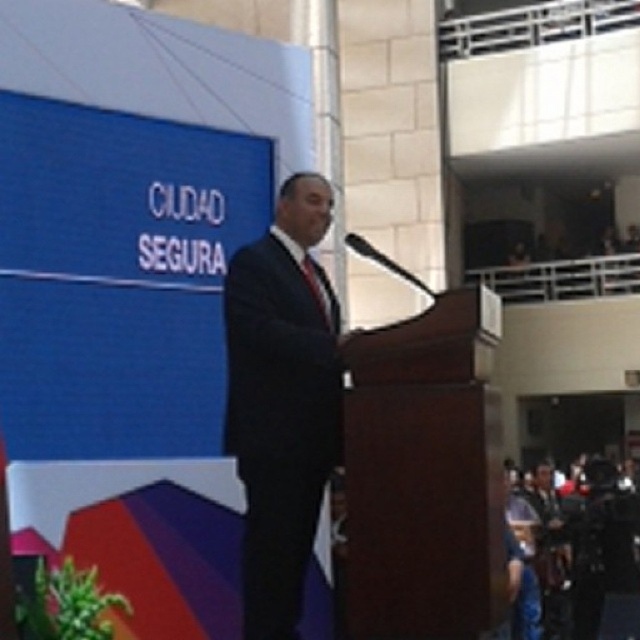
Question: Which point is farther to the camera?

Choices:
 (A) pos(289,420)
 (B) pos(300,268)

Answer: (B)

Question: Does dark suit at center come in front of red silk tie at center?

Choices:
 (A) no
 (B) yes

Answer: (B)

Question: Is dark suit at center positioned at the back of red silk tie at center?

Choices:
 (A) yes
 (B) no

Answer: (B)

Question: Does dark suit at center appear on the right side of red silk tie at center?

Choices:
 (A) no
 (B) yes

Answer: (A)

Question: Which object is closer to the camera taking this photo?

Choices:
 (A) dark suit at center
 (B) red silk tie at center

Answer: (A)